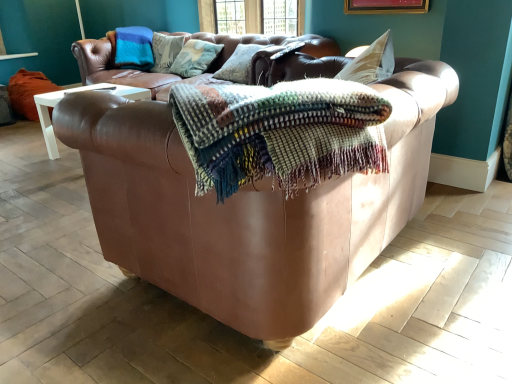
Describe the element at coordinates (242, 199) in the screenshot. I see `leather couch at center` at that location.

I want to click on leather couch at center, so click(x=242, y=199).

This screenshot has height=384, width=512. I want to click on leather couch at center, so click(242, 199).